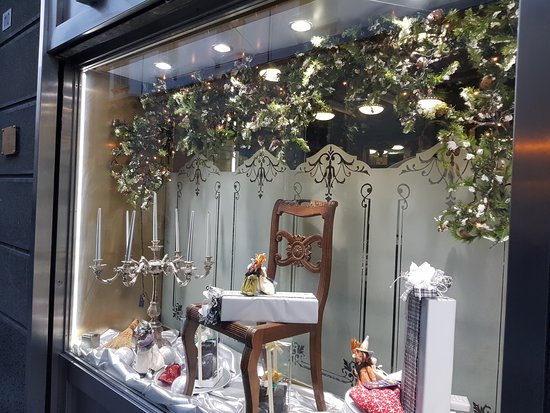
This screenshot has height=413, width=550. I want to click on chair leg, so click(182, 343), click(250, 359), click(319, 364).